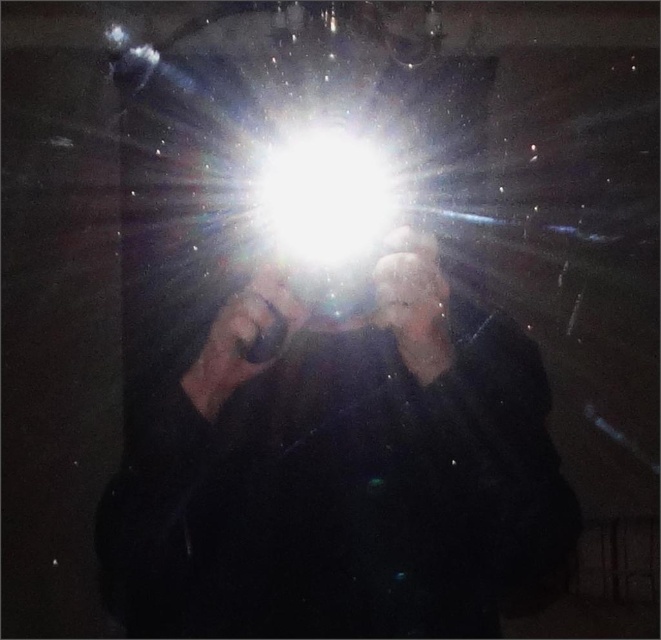
Question: From the image, what is the correct spatial relationship of black matte flashlight at center in relation to white glossy light at center?

Choices:
 (A) above
 (B) below

Answer: (B)

Question: Is black matte flashlight at center thinner than white glossy light at center?

Choices:
 (A) yes
 (B) no

Answer: (B)

Question: Which point appears closest to the camera in this image?

Choices:
 (A) (354, 221)
 (B) (254, 586)

Answer: (A)

Question: Can you confirm if black matte flashlight at center is bigger than white glossy light at center?

Choices:
 (A) no
 (B) yes

Answer: (B)

Question: Which point is farther to the camera?

Choices:
 (A) (332, 220)
 (B) (375, 460)

Answer: (B)